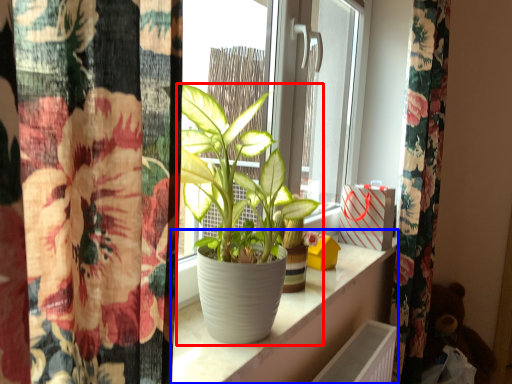
Question: Which of the following is the closest to the observer, houseplant (highlighted by a red box) or window sill (highlighted by a blue box)?

Choices:
 (A) houseplant
 (B) window sill

Answer: (A)